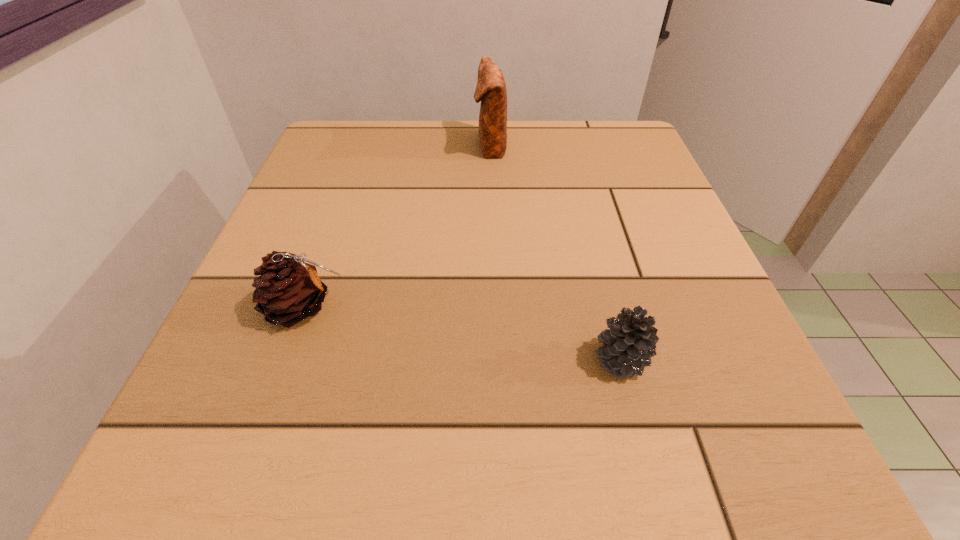
This screenshot has height=540, width=960. I want to click on vacant space that satisfies the following two spatial constraints: 1. with a leaf charm attached to the right pinecone; 2. on the left side of the farther pinecone, so click(285, 359).

Where is `vacant area in the image that satisfies the following two spatial constraints: 1. on the open side of the nearest object; 2. on the right side of the clutch bag`? vacant area in the image that satisfies the following two spatial constraints: 1. on the open side of the nearest object; 2. on the right side of the clutch bag is located at coordinates (496, 359).

Where is `vacant space that satisfies the following two spatial constraints: 1. on the open side of the nearer pinecone; 2. on the right side of the tallest object`? vacant space that satisfies the following two spatial constraints: 1. on the open side of the nearer pinecone; 2. on the right side of the tallest object is located at coordinates (496, 359).